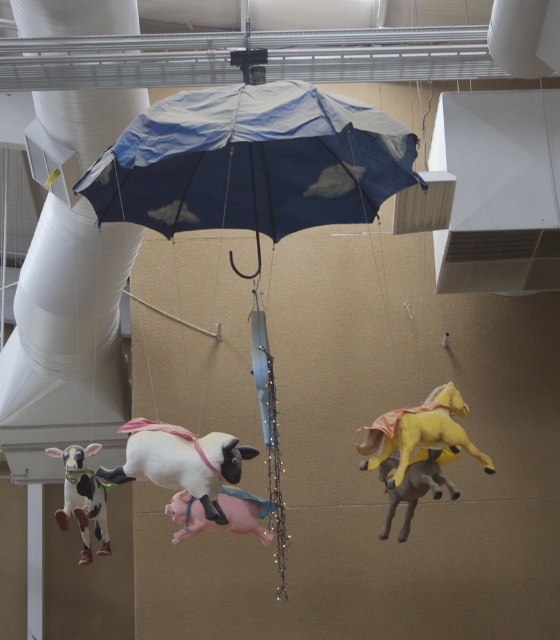
Question: Observing the image, what is the correct spatial positioning of white matte sheep at center in reference to pink matte pig at center?

Choices:
 (A) below
 (B) above

Answer: (B)

Question: Is white matte sheep at center above yellow matte horse at center?

Choices:
 (A) no
 (B) yes

Answer: (A)

Question: Among these points, which one is farthest from the camera?

Choices:
 (A) (240, 531)
 (B) (179, 440)
 (C) (438, 490)

Answer: (A)

Question: Which object is farther from the camera taking this photo?

Choices:
 (A) blue fabric umbrella at center
 (B) pink matte pig at center
 (C) yellow matte horse at center
 (D) rubber horse at center

Answer: (B)

Question: Is white matte sheep at center wider than white and black spotted plastic cow at lower left?

Choices:
 (A) no
 (B) yes

Answer: (B)

Question: Which point is closer to the camera taking this photo?

Choices:
 (A) (464, 403)
 (B) (189, 524)

Answer: (B)